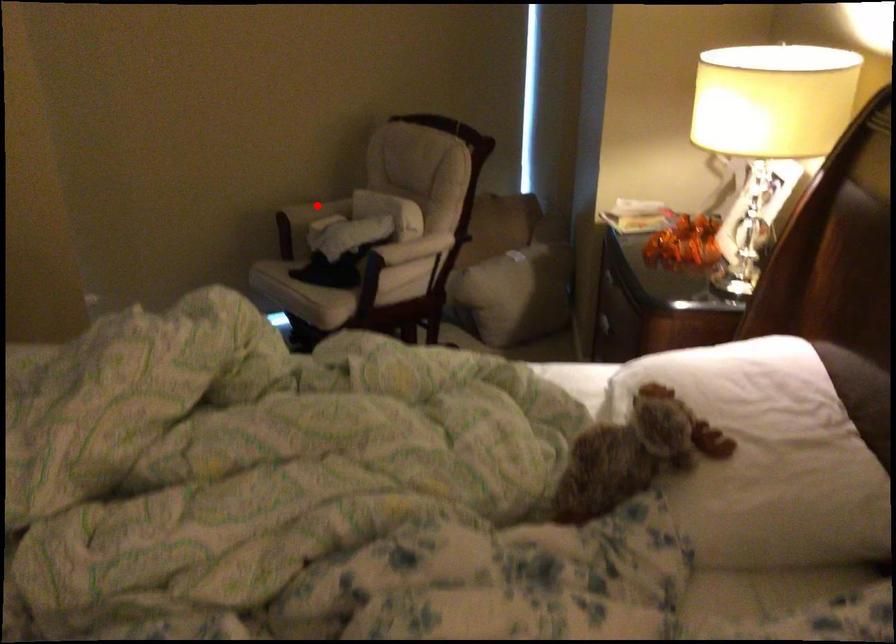
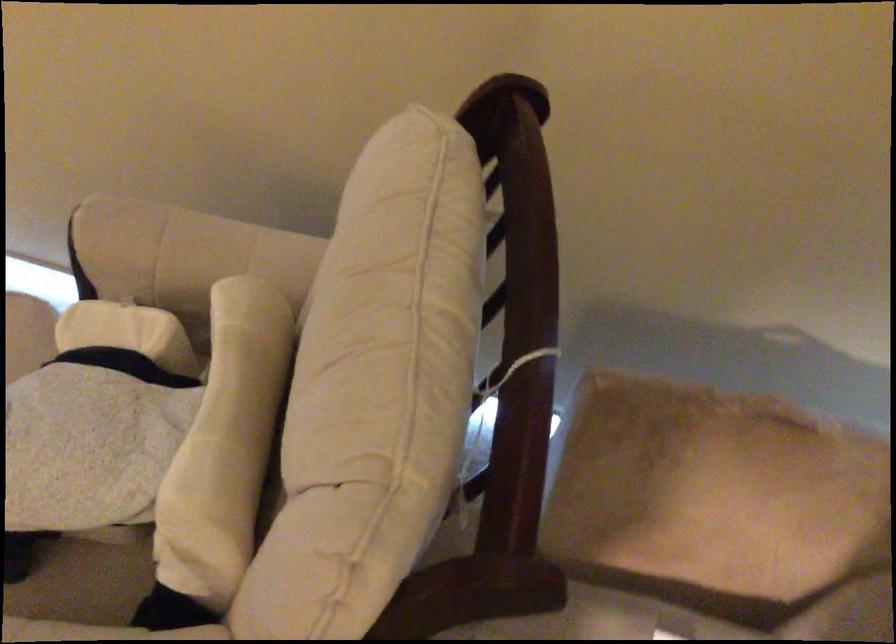
Question: A red point is marked in image1. In image2, is the corresponding 3D point closer to the camera or farther? Reply with the corresponding letter.

Choices:
 (A) The corresponding 3D point is closer.
 (B) The corresponding 3D point is farther.

Answer: (A)